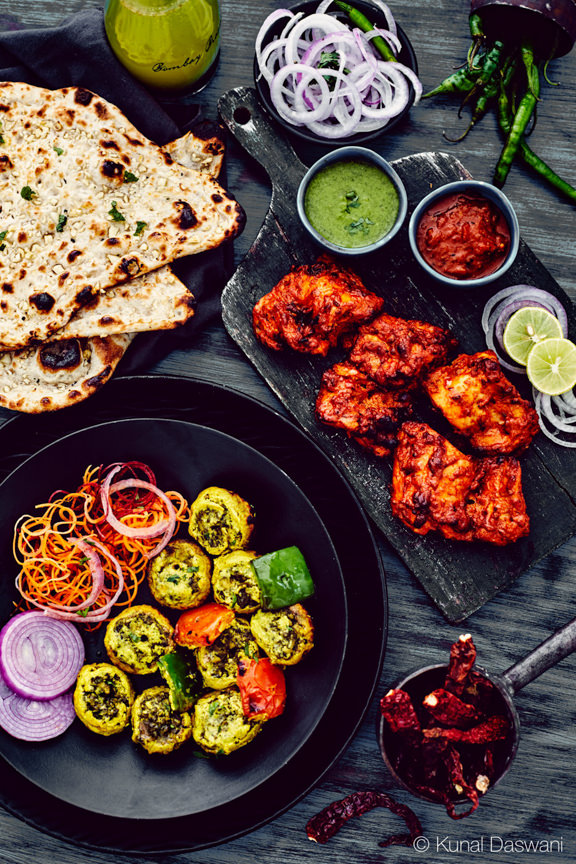
In order to click on bowls in this screenshot , I will do `click(363, 135)`, `click(413, 237)`, `click(377, 244)`, `click(414, 793)`.